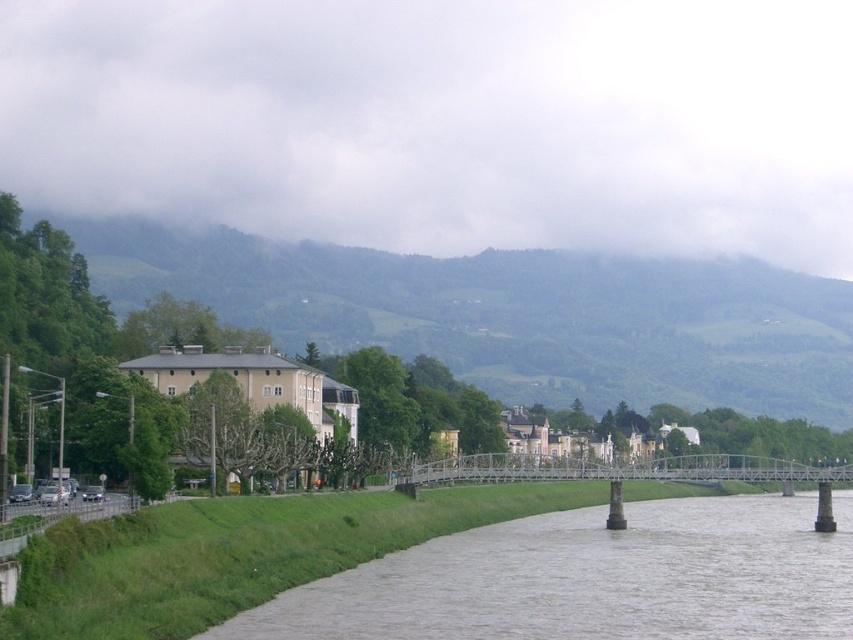
Question: Which point is closer to the camera?

Choices:
 (A) white metal bridge at center
 (B) gray concrete river at lower center

Answer: (B)

Question: Does gray concrete river at lower center have a greater width compared to white metal bridge at center?

Choices:
 (A) no
 (B) yes

Answer: (A)

Question: Is gray concrete river at lower center to the left of white metal bridge at center from the viewer's perspective?

Choices:
 (A) yes
 (B) no

Answer: (A)

Question: Among these objects, which one is farthest from the camera?

Choices:
 (A) gray concrete river at lower center
 (B) white metal bridge at center

Answer: (B)

Question: Is gray concrete river at lower center closer to the viewer compared to white metal bridge at center?

Choices:
 (A) no
 (B) yes

Answer: (B)